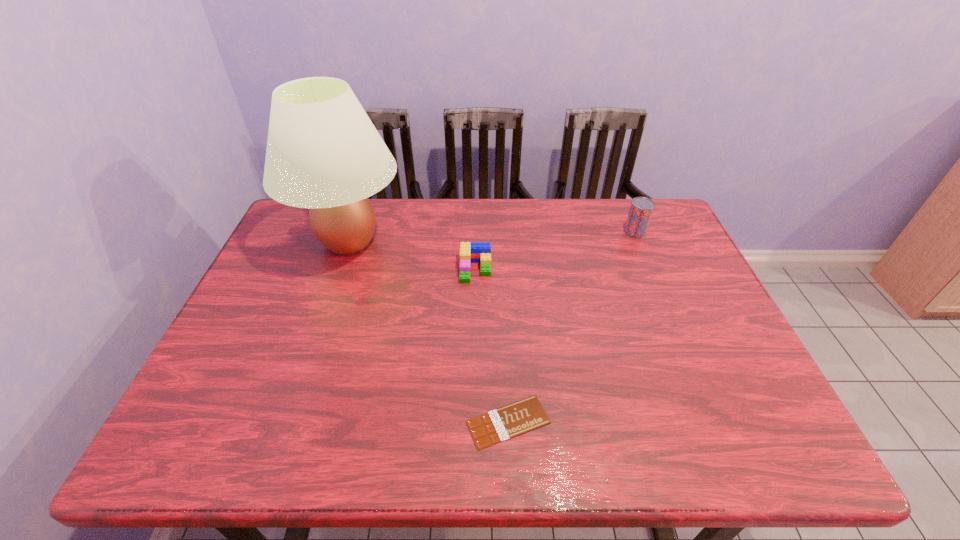
This screenshot has width=960, height=540. I want to click on the tallest object, so click(323, 152).

This screenshot has height=540, width=960. Identify the location of lampshade. (323, 152).

What are the coordinates of `the rightmost object` in the screenshot? It's located at (641, 209).

Where is `the third shortest object`? This screenshot has width=960, height=540. the third shortest object is located at coordinates (641, 209).

Locate an element on the screen. The width and height of the screenshot is (960, 540). Lego is located at coordinates (470, 252).

Locate an element on the screen. the nearest object is located at coordinates (509, 421).

You are a GUI agent. You are given a task and a screenshot of the screen. Output one action in this format:
    pyautogui.click(x=<x>, y=<y>)
    Task: Click on the shortest object
    The height and width of the screenshot is (540, 960).
    Given the screenshot: What is the action you would take?
    pyautogui.click(x=509, y=421)

Where is `free space located on the shade of the tallest object`? free space located on the shade of the tallest object is located at coordinates (521, 241).

The height and width of the screenshot is (540, 960). In order to click on free space located 0.150m on the left of the rightmost object in this screenshot , I will do `click(578, 231)`.

The height and width of the screenshot is (540, 960). What are the coordinates of `blank space located on the right of the Lego` in the screenshot? It's located at point(581,269).